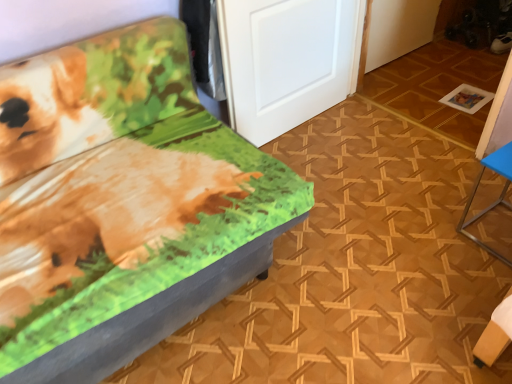
Find the location of a particular element. free point below blue metallic table at right, which is the 2th furniture from left to right (from a real-world perspective) is located at coordinates (497, 231).